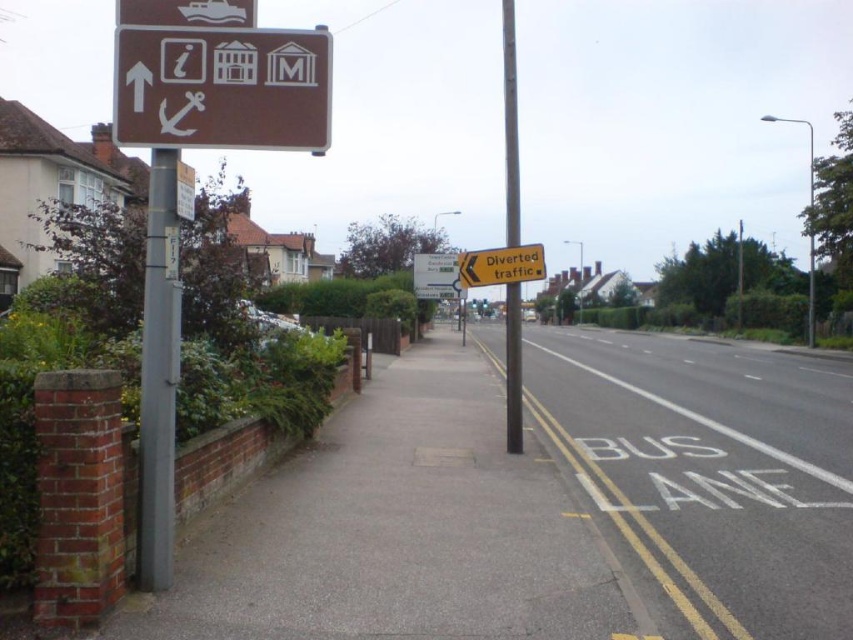
Question: Which of the following is the closest to the observer?

Choices:
 (A) (511, 83)
 (B) (155, 360)
 (C) (607, 412)
 (D) (555, 602)

Answer: (B)

Question: In this image, where is metallic gray pole at center located relative to yellow paper sign at upper center?

Choices:
 (A) right
 (B) left

Answer: (A)

Question: Does brown matte sign at upper left appear over green plastic sign at center?

Choices:
 (A) no
 (B) yes

Answer: (B)

Question: From the image, what is the correct spatial relationship of metallic gray pole at center in relation to yellow paper sign at upper center?

Choices:
 (A) right
 (B) left

Answer: (A)

Question: Which of the following is the farthest from the observer?

Choices:
 (A) yellow paper sign at upper center
 (B) brown matte sign at upper left
 (C) metallic pole at left
 (D) metallic gray pole at center

Answer: (A)

Question: Which point is closer to the camera?

Choices:
 (A) brown matte sign at upper left
 (B) gray concrete sidewalk at left
 (C) white painted pavement at lower right
 (D) green plastic sign at center

Answer: (B)